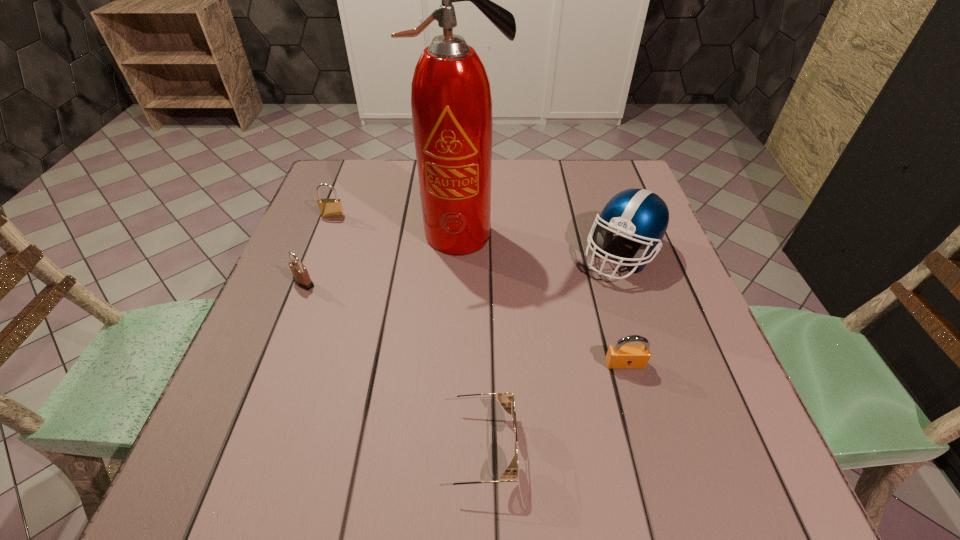
The image size is (960, 540). Identify the location of vacant area situated on the front-facing side of the farthest padlock. (317, 259).

The width and height of the screenshot is (960, 540). What are the coordinates of `free space located on the right of the second farthest padlock` in the screenshot? It's located at tap(351, 283).

Locate an element on the screen. free spot located 0.200m to unlock the rightmost padlock from the front is located at coordinates (657, 478).

Locate an element on the screen. blank space located on the front lenses of the shortest object is located at coordinates (636, 447).

Image resolution: width=960 pixels, height=540 pixels. Identify the location of object that is positioned at the near edge. pyautogui.click(x=505, y=398).

Find the location of a particular element. football helmet situated at the right edge is located at coordinates (640, 215).

Identify the location of padlock located in the right edge section of the desktop. (619, 356).

Identify the location of free space at the far edge. (392, 183).

This screenshot has width=960, height=540. What are the coordinates of `free space at the near edge of the desktop` in the screenshot? It's located at (397, 452).

This screenshot has width=960, height=540. Find the location of `vacant region at the left edge of the desktop`. vacant region at the left edge of the desktop is located at coordinates (259, 404).